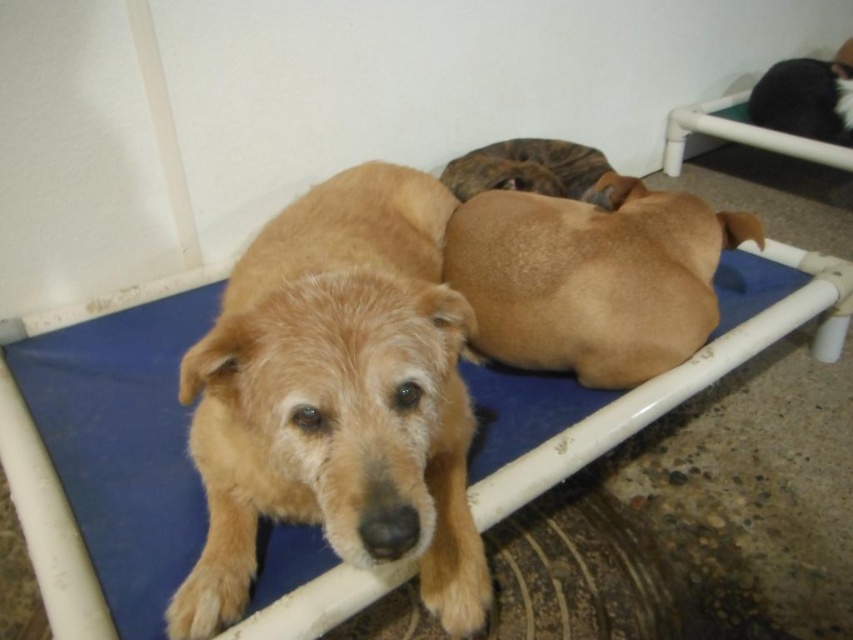
You are a dog owner who wants to ensure both dogs have enough space on the blue fabric dog bed at center. Considering the black fur at upper right is part of one of the dogs, can you determine if the bed is tall enough to accommodate both dogs comfortably?

The blue fabric dog bed at center is much taller than the black fur at upper right, so yes, the bed is tall enough to accommodate both dogs comfortably.

You are a dog owner who wants to place a new toy between the blue fabric dog bed at center and the black fur at upper right. According to the scene, where should you place the toy so it is exactly halfway between the two?

The blue fabric dog bed at center is to the left of black fur at upper right, so placing the toy halfway between them would require positioning it in the middle of the line connecting their positions.

You are a pet owner who wants to ensure the blue fabric dog bed at center is comfortable for the brown fur dog at center. Based on the scene, can you confirm if the bed is properly supporting the dog?

The blue fabric dog bed at center is positioned under the brown fur dog at center, indicating that it is supporting the dog appropriately.